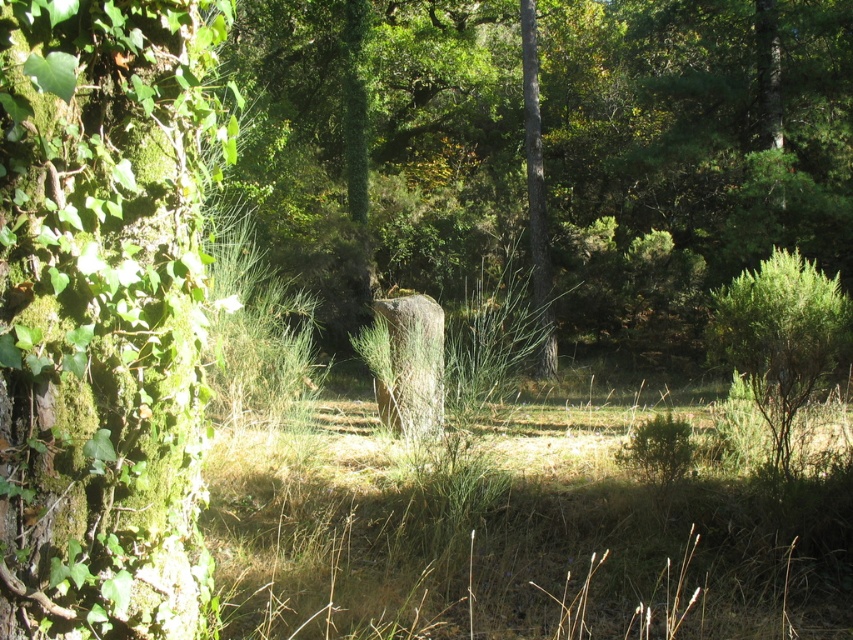
Who is taller, green mossy rock at center or brown dry grass at center?

green mossy rock at center

Where is `green mossy rock at center`? This screenshot has height=640, width=853. green mossy rock at center is located at coordinates (550, 150).

Locate an element on the screen. This screenshot has width=853, height=640. green mossy rock at center is located at coordinates (550, 150).

Which is in front, point (84, 476) or point (581, 426)?

Positioned in front is point (84, 476).

In the scene shown: Who is positioned more to the left, green mossy tree trunk at left or brown dry grass at center?

green mossy tree trunk at left is more to the left.

Which is in front, point (25, 424) or point (344, 397)?

Positioned in front is point (25, 424).

The height and width of the screenshot is (640, 853). I want to click on green mossy tree trunk at left, so click(103, 310).

Between green mossy rock at center and green mossy tree trunk at left, which one has more height?

Standing taller between the two is green mossy rock at center.

Which of these two, green mossy rock at center or green mossy tree trunk at left, stands shorter?

Standing shorter between the two is green mossy tree trunk at left.

Is point (556, 342) less distant than point (57, 120)?

No, (556, 342) is further to viewer.

At what (x,y) coordinates should I click in order to perform the action: click on green mossy rock at center. Please return your answer as a coordinate pair (x, y). Looking at the image, I should click on (550, 150).